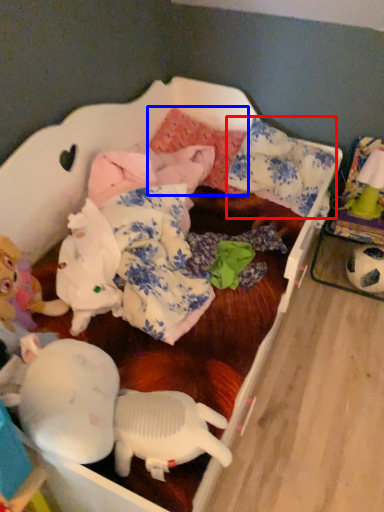
Question: Which point is closer to the camera, pillow (highlighted by a red box) or pillow (highlighted by a blue box)?

Choices:
 (A) pillow
 (B) pillow

Answer: (A)